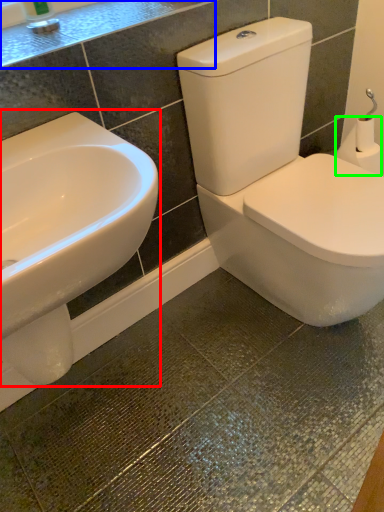
Question: Which object is the closest to the sink (highlighted by a red box)? Choose among these: counter top (highlighted by a blue box) or toilet paper (highlighted by a green box).

Choices:
 (A) counter top
 (B) toilet paper

Answer: (A)